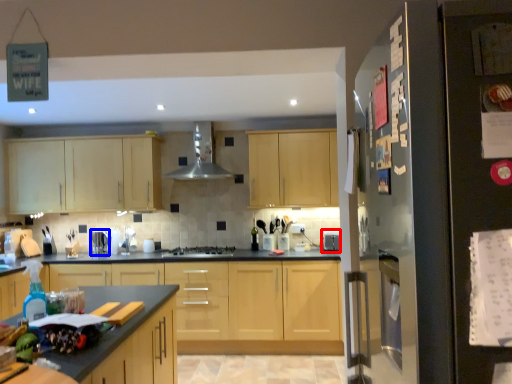
Question: Which of the following is the farthest to the observer, appliance (highlighted by a red box) or appliance (highlighted by a blue box)?

Choices:
 (A) appliance
 (B) appliance

Answer: (B)